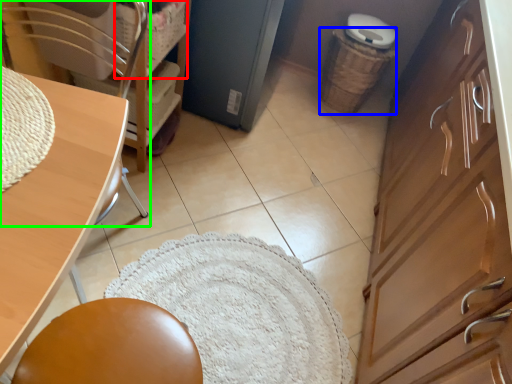
Question: Which object is positioned farthest from basket (highlighted by a red box)? Select from basket (highlighted by a blue box) and chair (highlighted by a green box).

Choices:
 (A) basket
 (B) chair

Answer: (A)